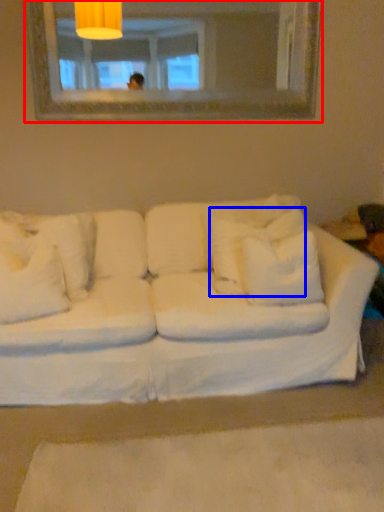
Question: Which object is closer to the camera taking this photo, mirror (highlighted by a red box) or pillow (highlighted by a blue box)?

Choices:
 (A) mirror
 (B) pillow

Answer: (B)